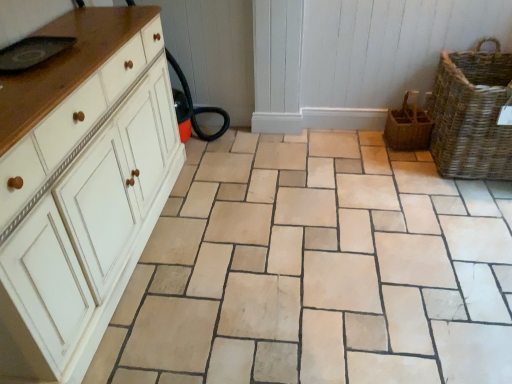
Question: From a real-world perspective, is white painted wood chest of drawers at left positioned under woven brown basket at right, the second basket viewed from the right, based on gravity?

Choices:
 (A) no
 (B) yes

Answer: (A)

Question: Does white painted wood chest of drawers at left have a lesser width compared to woven brown basket at right, the 1th basket in the left-to-right sequence?

Choices:
 (A) no
 (B) yes

Answer: (A)

Question: Considering the relative sizes of white painted wood chest of drawers at left and woven brown basket at right, the second basket viewed from the right, in the image provided, is white painted wood chest of drawers at left smaller than woven brown basket at right, the second basket viewed from the right,?

Choices:
 (A) yes
 (B) no

Answer: (B)

Question: Is white painted wood chest of drawers at left bigger than woven brown basket at right, the 1th basket in the left-to-right sequence?

Choices:
 (A) yes
 (B) no

Answer: (A)

Question: Does white painted wood chest of drawers at left have a greater height compared to woven brown basket at right, the second basket viewed from the right?

Choices:
 (A) no
 (B) yes

Answer: (B)

Question: From the image's perspective, would you say white painted wood chest of drawers at left is positioned over woven brown basket at right, the second basket viewed from the right?

Choices:
 (A) no
 (B) yes

Answer: (A)

Question: Is beige stone tile at center located within woven brown basket at right, the 1th basket in the left-to-right sequence?

Choices:
 (A) yes
 (B) no

Answer: (B)

Question: From a real-world perspective, is woven brown basket at right, the second basket viewed from the right, below beige stone tile at center?

Choices:
 (A) no
 (B) yes

Answer: (A)

Question: Is woven brown basket at right, the second basket viewed from the right, located outside beige stone tile at center?

Choices:
 (A) no
 (B) yes

Answer: (B)

Question: Does woven brown basket at right, the 1th basket in the left-to-right sequence, have a smaller size compared to beige stone tile at center?

Choices:
 (A) no
 (B) yes

Answer: (B)

Question: Is woven brown basket at right, the second basket viewed from the right, shorter than beige stone tile at center?

Choices:
 (A) yes
 (B) no

Answer: (B)

Question: Is woven brown basket at right, the second basket viewed from the right, to the left of beige stone tile at center from the viewer's perspective?

Choices:
 (A) no
 (B) yes

Answer: (A)

Question: From a real-world perspective, is woven brown basket at right, the 1th basket viewed from the right, on top of white painted wood chest of drawers at left?

Choices:
 (A) yes
 (B) no

Answer: (B)